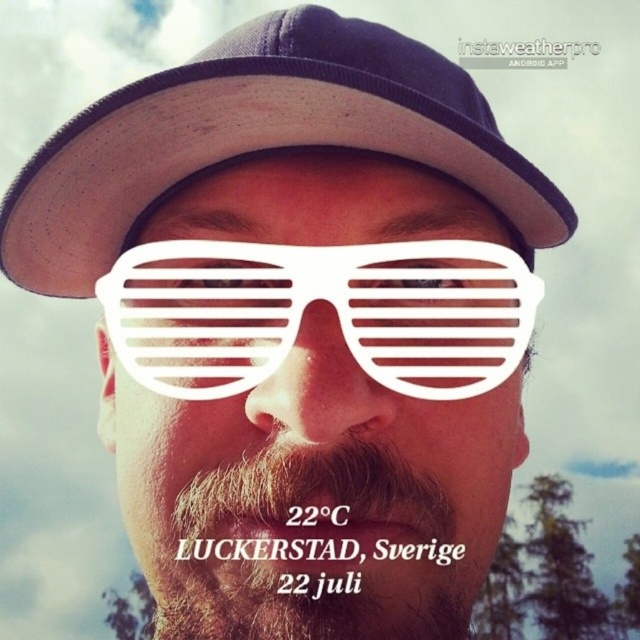
You are a GUI agent. You are given a task and a screenshot of the screen. Output one action in this format:
    pyautogui.click(x=<x>, y=<y>)
    Task: Click on the white plastic sunglasses at center
    
    Given the screenshot: What is the action you would take?
    tap(330, 307)

Does white plastic sunglasses at center appear over brownwoollybeard at lower center?

Indeed, white plastic sunglasses at center is positioned over brownwoollybeard at lower center.

Between point (161, 276) and point (348, 465), which one is positioned behind?

The point (161, 276) is behind.

The height and width of the screenshot is (640, 640). In order to click on white plastic sunglasses at center in this screenshot , I will do `click(330, 307)`.

Measure the distance between dark blue fabric baseball hat at upper center and camera.

dark blue fabric baseball hat at upper center and camera are 29.44 inches apart from each other.

You are a GUI agent. You are given a task and a screenshot of the screen. Output one action in this format:
    pyautogui.click(x=<x>, y=<y>)
    Task: Click on the dark blue fabric baseball hat at upper center
    This screenshot has height=640, width=640.
    Given the screenshot: What is the action you would take?
    pyautogui.click(x=259, y=138)

Does dark blue fabric baseball hat at upper center appear over white plastic sunglasses at center?

Yes, dark blue fabric baseball hat at upper center is above white plastic sunglasses at center.

Can you confirm if dark blue fabric baseball hat at upper center is wider than white plastic sunglasses at center?

Correct, the width of dark blue fabric baseball hat at upper center exceeds that of white plastic sunglasses at center.

Is point (179, 106) positioned behind point (282, 257)?

No, it is not.

Identify the location of dark blue fabric baseball hat at upper center. Image resolution: width=640 pixels, height=640 pixels. (259, 138).